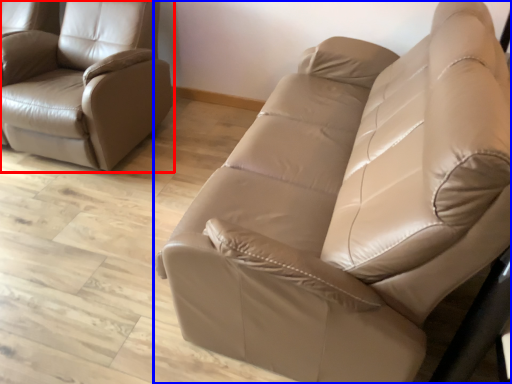
Question: Which object is further to the camera taking this photo, chair (highlighted by a red box) or studio couch (highlighted by a blue box)?

Choices:
 (A) chair
 (B) studio couch

Answer: (A)